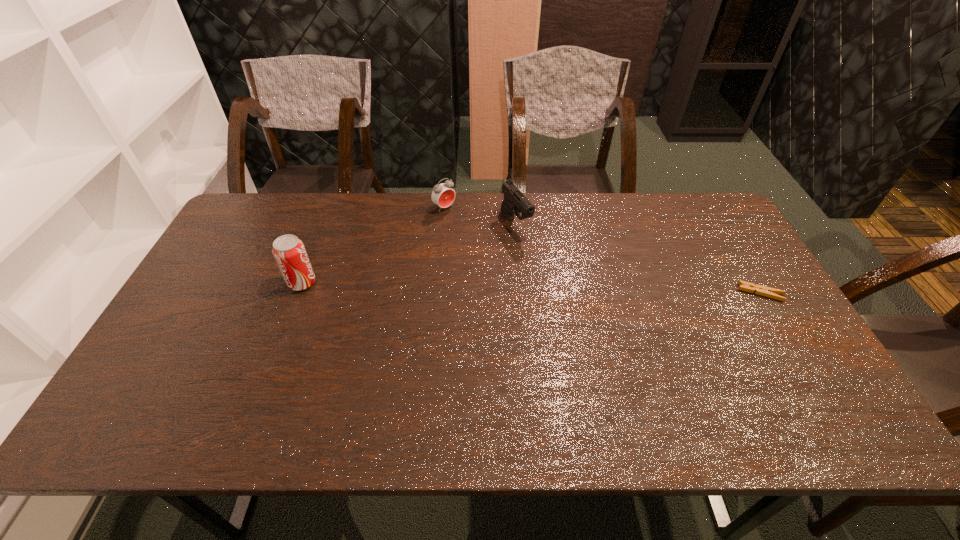
In order to click on vacant space located on the face of the alarm clock in this screenshot , I will do `click(472, 231)`.

The height and width of the screenshot is (540, 960). Find the location of `free space located on the face of the alarm clock`. free space located on the face of the alarm clock is located at coordinates (516, 268).

The height and width of the screenshot is (540, 960). Find the location of `free space located on the face of the alarm clock`. free space located on the face of the alarm clock is located at coordinates (523, 274).

This screenshot has height=540, width=960. I want to click on pistol that is at the far edge, so click(514, 201).

At what (x,y) coordinates should I click in order to perform the action: click on alarm clock that is at the far edge. Please return your answer as a coordinate pair (x, y). This screenshot has width=960, height=540. Looking at the image, I should click on (443, 195).

At what (x,y) coordinates should I click in order to perform the action: click on object located in the right edge section of the desktop. Please return your answer as a coordinate pair (x, y). This screenshot has height=540, width=960. Looking at the image, I should click on (761, 290).

The height and width of the screenshot is (540, 960). Identify the location of vacant space at the far edge of the desktop. coord(597,205).

Where is `blank space at the near edge of the desktop`? blank space at the near edge of the desktop is located at coordinates (533, 390).

This screenshot has width=960, height=540. I want to click on blank space at the left edge of the desktop, so click(x=228, y=323).

Where is `free space at the right edge of the desktop`? free space at the right edge of the desktop is located at coordinates (763, 341).